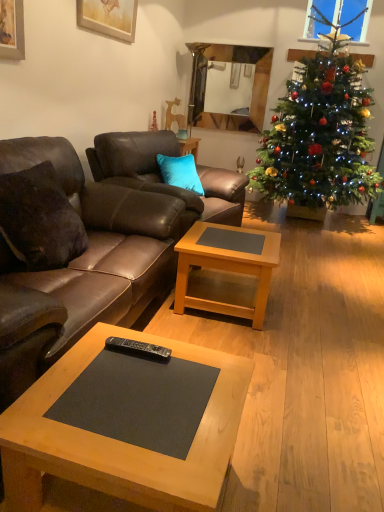
Locate an element on the screen. This screenshot has width=384, height=512. vacant space in front of black plastic remote control at center is located at coordinates (128, 381).